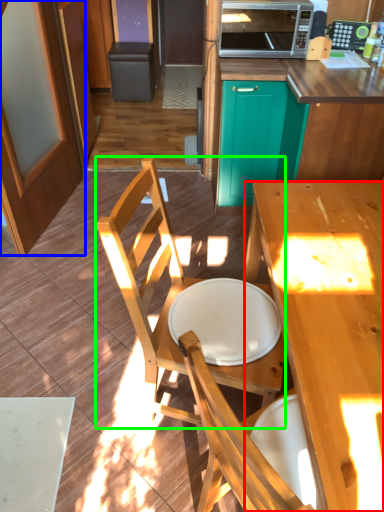
Question: Which object is positioned closest to desk (highlighted by a red box)? Select from screen door (highlighted by a blue box) and chair (highlighted by a green box).

Choices:
 (A) screen door
 (B) chair

Answer: (B)